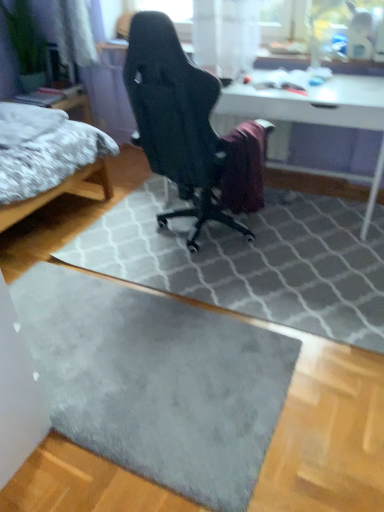
This screenshot has height=512, width=384. Find the location of `vacant space in front of white glossy table at center`. vacant space in front of white glossy table at center is located at coordinates (296, 269).